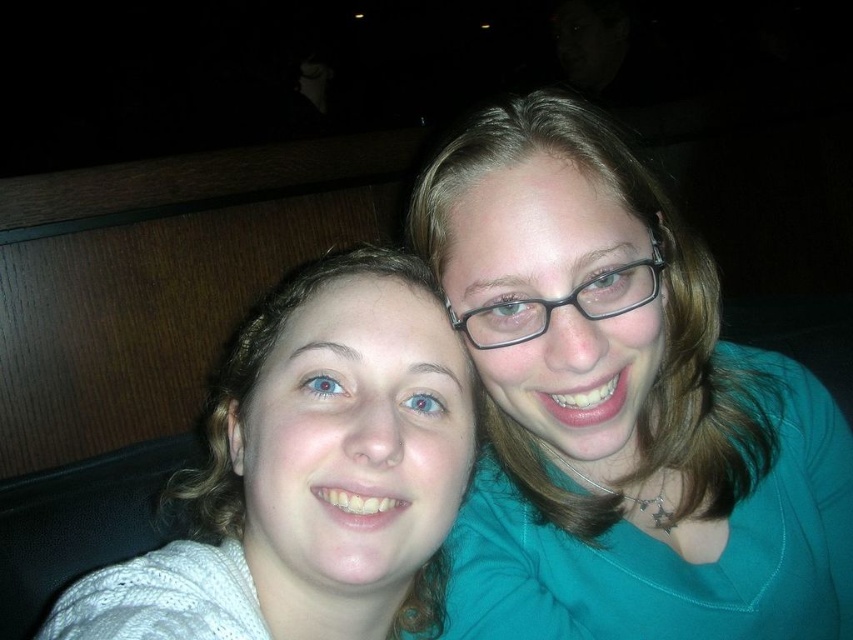
Is teal fabric shirt at upper right to the left of white knit sweater at left from the viewer's perspective?

In fact, teal fabric shirt at upper right is to the right of white knit sweater at left.

Does teal fabric shirt at upper right have a greater height compared to white knit sweater at left?

Indeed, teal fabric shirt at upper right has a greater height compared to white knit sweater at left.

The height and width of the screenshot is (640, 853). I want to click on teal fabric shirt at upper right, so click(x=621, y=406).

The height and width of the screenshot is (640, 853). I want to click on teal fabric shirt at upper right, so click(621, 406).